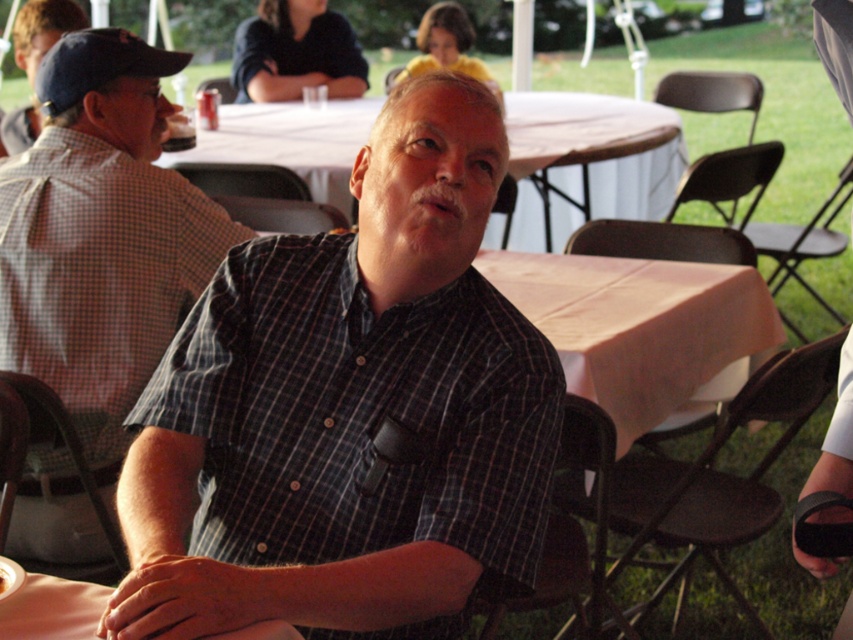
Is white cloth table at center closer to camera compared to brown crumbly bread at center?

No, it is behind brown crumbly bread at center.

Is point (280, 138) behind point (0, 598)?

That is True.

Between point (219, 115) and point (13, 580), which one is positioned in front?

Point (13, 580)

I want to click on white cloth table at center, so click(590, 160).

Does matte plaid shirt at left appear on the left side of brown crumbly bread at center?

Correct, you'll find matte plaid shirt at left to the left of brown crumbly bread at center.

Looking at this image, is matte plaid shirt at left shorter than brown crumbly bread at center?

In fact, matte plaid shirt at left may be taller than brown crumbly bread at center.

Is point (20, 28) farther from viewer compared to point (7, 580)?

Yes, it is.

The width and height of the screenshot is (853, 640). I want to click on matte plaid shirt at left, so click(42, 29).

Which is below, checkered fabric shirt at center or white cloth table at center?

Positioned lower is checkered fabric shirt at center.

Between checkered fabric shirt at center and white cloth table at center, which one has more height?

Standing taller between the two is checkered fabric shirt at center.

The width and height of the screenshot is (853, 640). What are the coordinates of `checkered fabric shirt at center` in the screenshot? It's located at (102, 234).

I want to click on checkered fabric shirt at center, so click(102, 234).